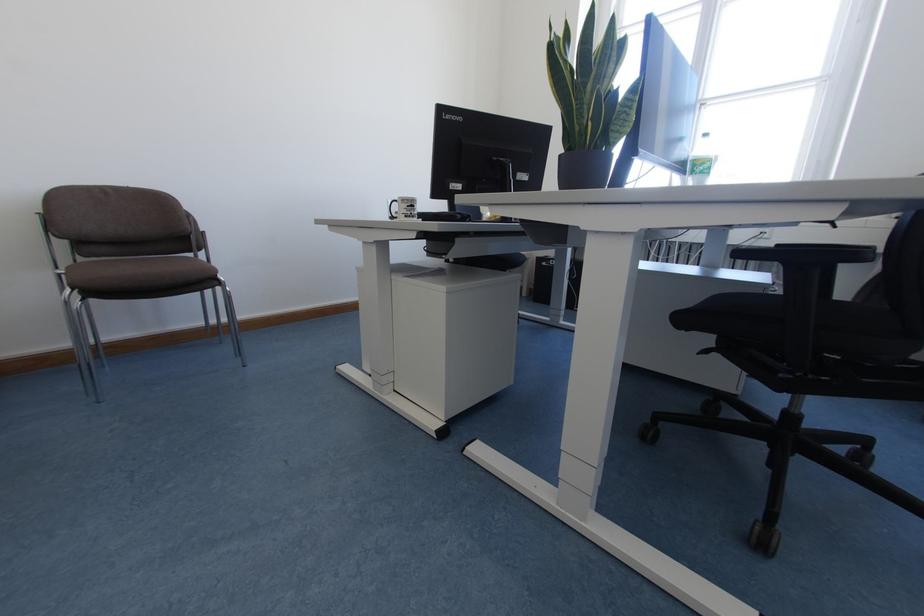
Locate an element on the screen. black chair sitting surface is located at coordinates (137, 273).